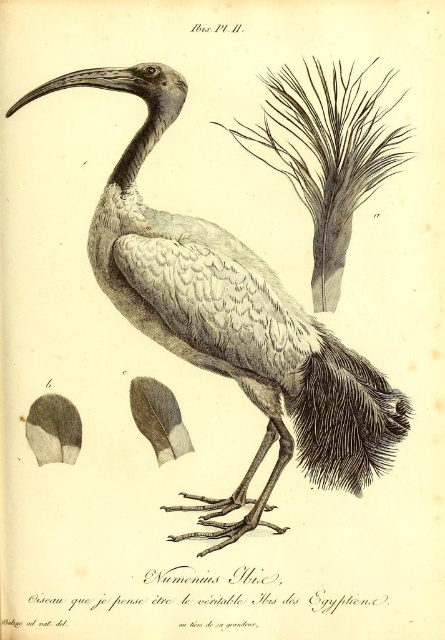
Question: Which of the following is the farthest from the observer?

Choices:
 (A) gray feathered bird at center
 (B) dark gray textured feathers at lower right

Answer: (B)

Question: Which point appears closest to the camera in this image?

Choices:
 (A) (319, 384)
 (B) (355, 435)

Answer: (B)

Question: Which point is farther to the camera?

Choices:
 (A) dark gray textured feathers at lower right
 (B) gray feathered bird at center

Answer: (A)

Question: Is gray feathered bird at center bigger than dark gray textured feathers at lower right?

Choices:
 (A) yes
 (B) no

Answer: (A)

Question: Can you confirm if gray feathered bird at center is thinner than dark gray textured feathers at lower right?

Choices:
 (A) no
 (B) yes

Answer: (A)

Question: Is gray feathered bird at center to the right of dark gray textured feathers at lower right from the viewer's perspective?

Choices:
 (A) no
 (B) yes

Answer: (A)